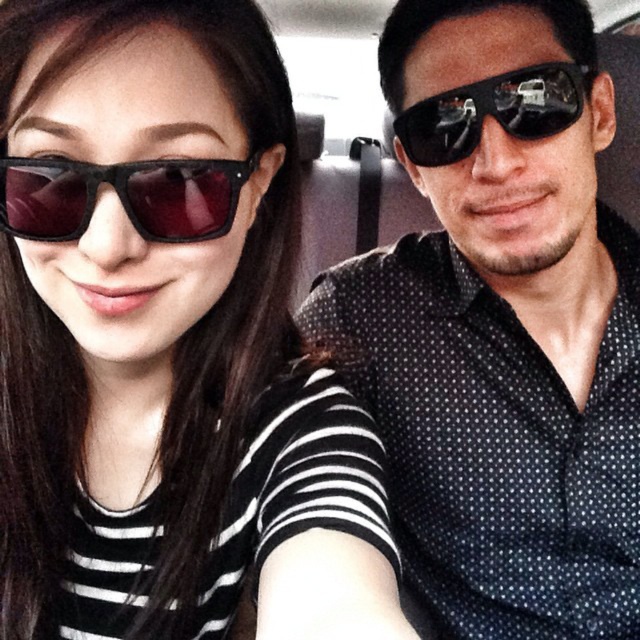
Is matte black sunglasses at upper right smaller than matte black sunglasses at left?

Actually, matte black sunglasses at upper right might be larger than matte black sunglasses at left.

Is the position of matte black sunglasses at upper right less distant than that of matte black sunglasses at left?

No, it is behind matte black sunglasses at left.

Is point (593, 320) positioned in front of point (76, 189)?

No, (593, 320) is behind (76, 189).

Locate an element on the screen. The image size is (640, 640). matte black sunglasses at upper right is located at coordinates (500, 342).

Based on the photo, which is more to the left, matte black sunglasses at upper left or matte black sunglasses at upper right?

From the viewer's perspective, matte black sunglasses at upper left appears more on the left side.

Which of these two, matte black sunglasses at upper left or matte black sunglasses at upper right, stands shorter?

With less height is matte black sunglasses at upper left.

What do you see at coordinates (168, 342) in the screenshot? I see `matte black sunglasses at upper left` at bounding box center [168, 342].

The image size is (640, 640). I want to click on matte black sunglasses at upper left, so click(168, 342).

Does matte black sunglasses at upper left appear on the left side of matte black sunglasses at left?

Incorrect, matte black sunglasses at upper left is not on the left side of matte black sunglasses at left.

Is matte black sunglasses at upper left positioned before matte black sunglasses at left?

Yes, it is.

Describe the element at coordinates (168, 342) in the screenshot. The width and height of the screenshot is (640, 640). I see `matte black sunglasses at upper left` at that location.

The image size is (640, 640). I want to click on matte black sunglasses at upper left, so click(x=168, y=342).